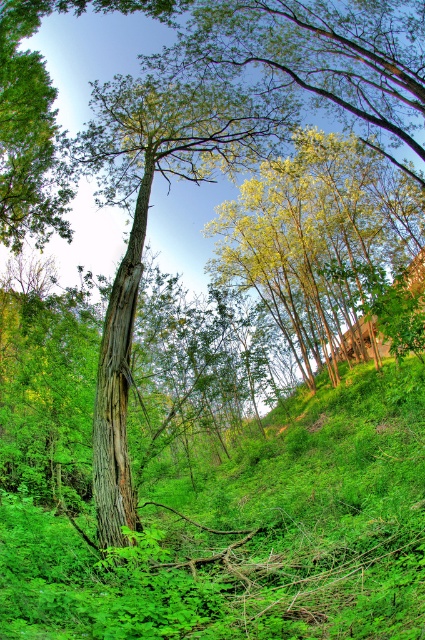
You are standing in the forest and notice the green leafy grass at center and the brown rough bark tree trunk at center. From your perspective, which object is positioned to the right?

The green leafy grass at center is to the right of the brown rough bark tree trunk at center.

You are a hiker who wants to take a photo of the brown rough bark tree trunk at center without the green bark tree at center blocking the view. What should you do?

Move to a lower position so that the brown rough bark tree trunk at center is visible below the green bark tree at center.

You are a hiker standing in the forest scene described. You need to determine which object is taller between the green leafy grass at center and the green bark tree at center. Based on the scene, which one is taller?

The green bark tree at center is taller than the green leafy grass at center.